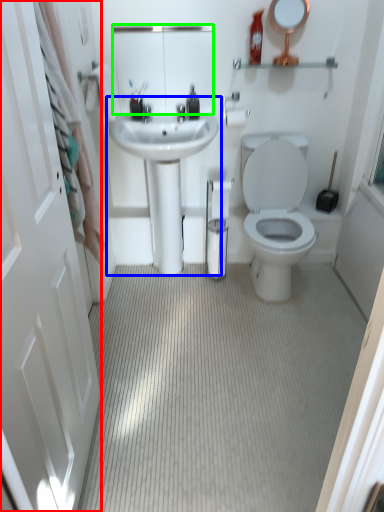
Question: Estimate the real-world distances between objects in this image. Which object is farther from screen door (highlighted by a red box), sink (highlighted by a blue box) or mirror (highlighted by a green box)?

Choices:
 (A) sink
 (B) mirror

Answer: (B)